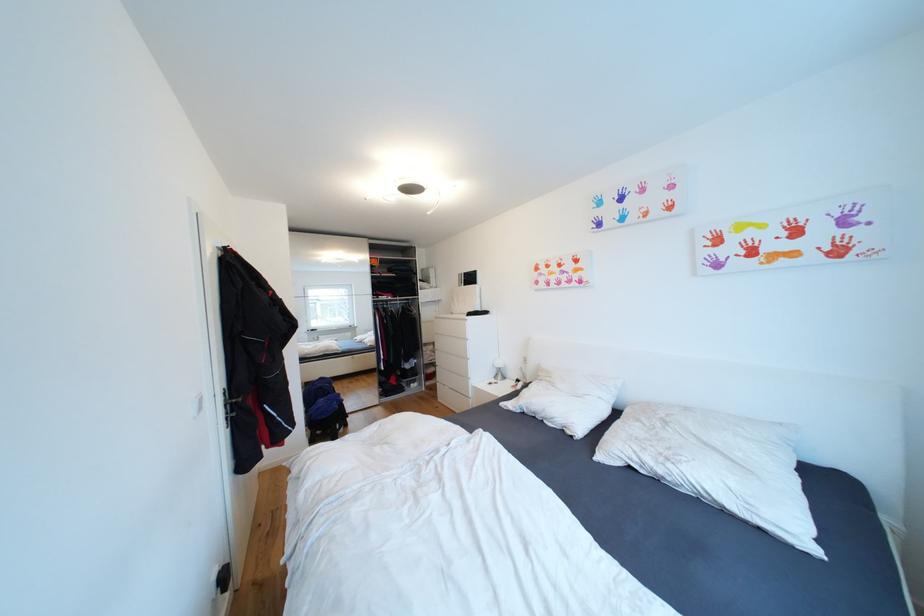
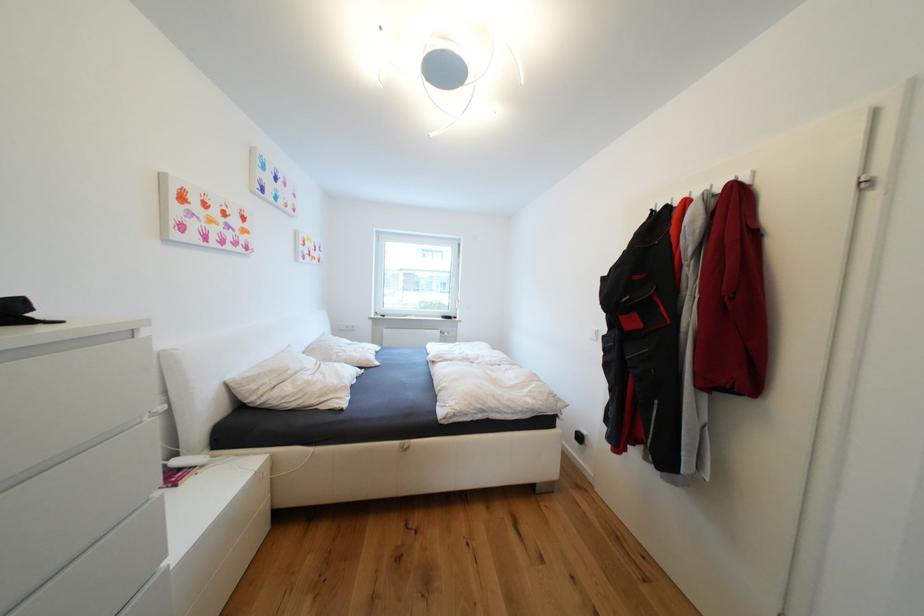
The point at (555, 383) is marked in the first image. Where is the corresponding point in the second image?

(304, 374)